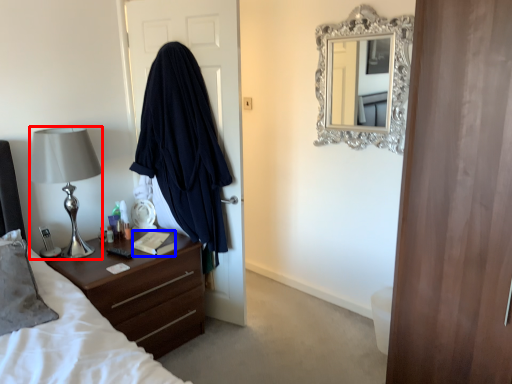
Question: Which object is further to the camera taking this photo, lamp (highlighted by a red box) or book (highlighted by a blue box)?

Choices:
 (A) lamp
 (B) book

Answer: (B)